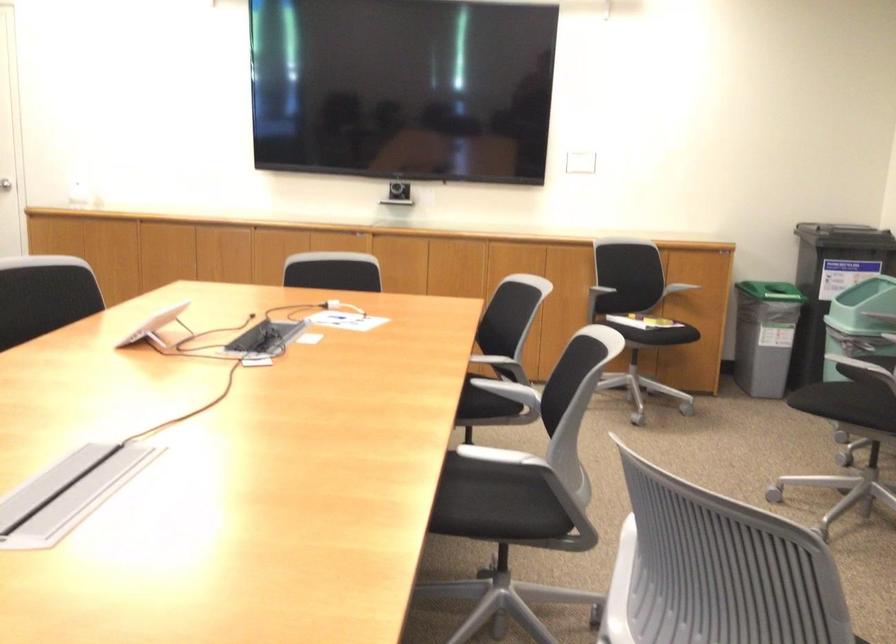
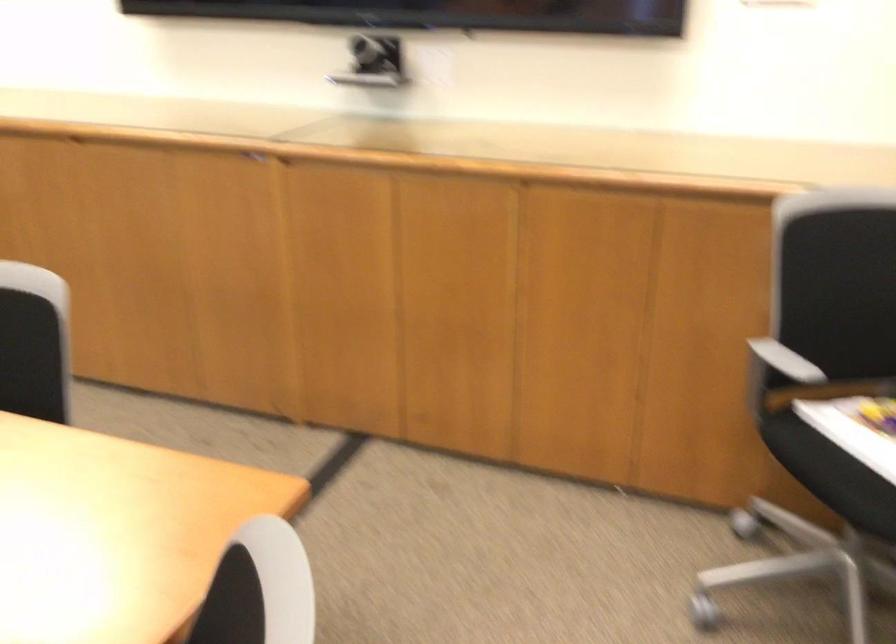
Question: I am providing you with two images of the same scene from different viewpoints. Please identify which objects are invisible in image2.

Choices:
 (A) red carabiner
 (B) chair sitting surface
 (C) chair armrest
 (D) black webcam

Answer: (D)